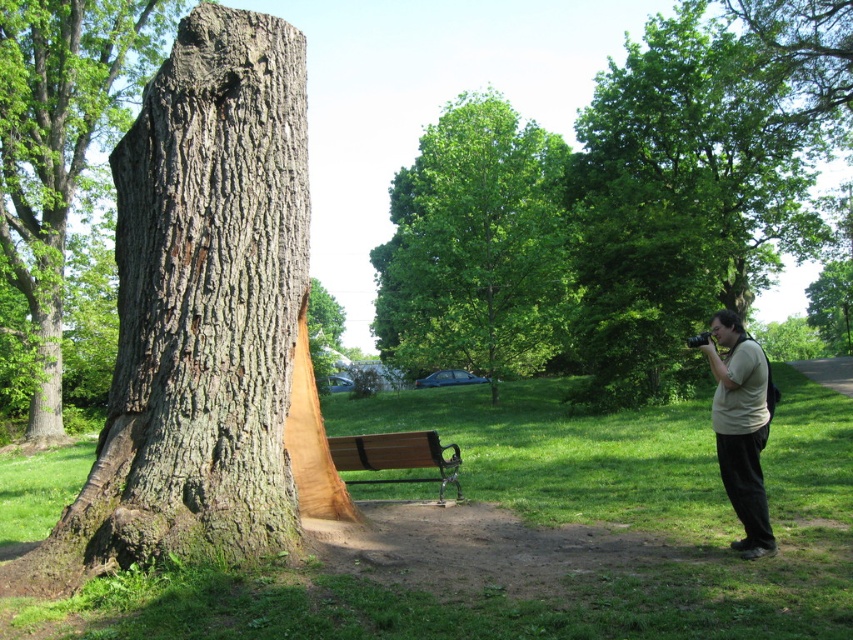
Is point (106, 493) positioned behind point (532, 300)?

No, it is not.

Is the position of smooth bark tree trunk at center more distant than that of green leafy tree at center?

That is False.

Is point (83, 509) in front of point (436, 282)?

Yes, it is.

Where is `smooth bark tree trunk at center`? smooth bark tree trunk at center is located at coordinates (202, 305).

Based on the photo, can you confirm if green leafy tree at center is positioned to the right of light beige shirt at right?

In fact, green leafy tree at center is to the left of light beige shirt at right.

Is point (509, 227) closer to camera compared to point (750, 381)?

No, (509, 227) is behind (750, 381).

You are a GUI agent. You are given a task and a screenshot of the screen. Output one action in this format:
    pyautogui.click(x=<x>, y=<y>)
    Task: Click on the green leafy tree at center
    
    Given the screenshot: What is the action you would take?
    pyautogui.click(x=476, y=244)

Which is more to the right, smooth bark tree trunk at center or green leafy tree at right?

Positioned to the right is green leafy tree at right.

Is smooth bark tree trunk at center positioned before green leafy tree at right?

Yes, smooth bark tree trunk at center is in front of green leafy tree at right.

Between point (180, 323) and point (584, 140), which one is positioned in front?

Positioned in front is point (180, 323).

Locate an element on the screen. The height and width of the screenshot is (640, 853). smooth bark tree trunk at center is located at coordinates (202, 305).